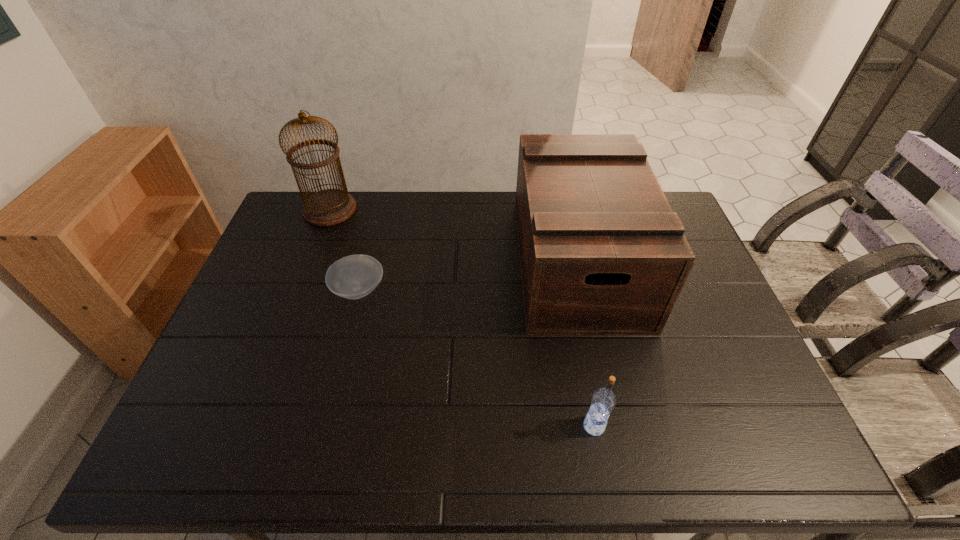
This screenshot has width=960, height=540. I want to click on the leftmost object, so click(327, 207).

Where is `birdcage`? birdcage is located at coordinates (327, 207).

This screenshot has height=540, width=960. Find the location of `box`. box is located at coordinates (601, 252).

In order to click on vodka in this screenshot , I will do `click(603, 401)`.

What are the coordinates of `the nearest object` in the screenshot? It's located at (603, 401).

This screenshot has height=540, width=960. I want to click on bowl, so coord(355,276).

Find the location of `the second object from left to right`. the second object from left to right is located at coordinates (355, 276).

You are a GUI agent. You are given a task and a screenshot of the screen. Output one action in this format:
    pyautogui.click(x=<x>, y=<y>)
    Task: Click on the vacant region located 0.290m on the front-facing side of the tallest object
    This screenshot has height=540, width=960.
    Given the screenshot: What is the action you would take?
    pyautogui.click(x=437, y=210)

Image resolution: width=960 pixels, height=540 pixels. I want to click on vacant space located 0.220m on the left of the box, so click(451, 262).

Find the location of `blank space located 0.120m on the right of the vodka`. blank space located 0.120m on the right of the vodka is located at coordinates (657, 426).